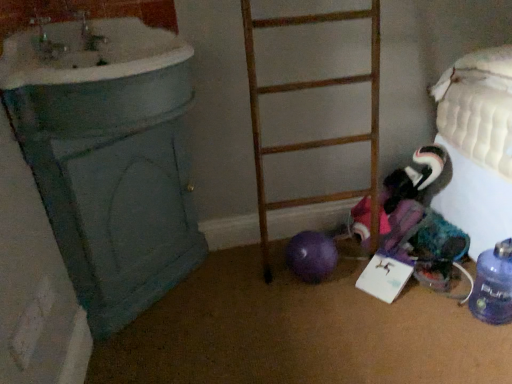
The image size is (512, 384). Find the location of `free spot in front of blue translucent bottle at lower right`. free spot in front of blue translucent bottle at lower right is located at coordinates (487, 342).